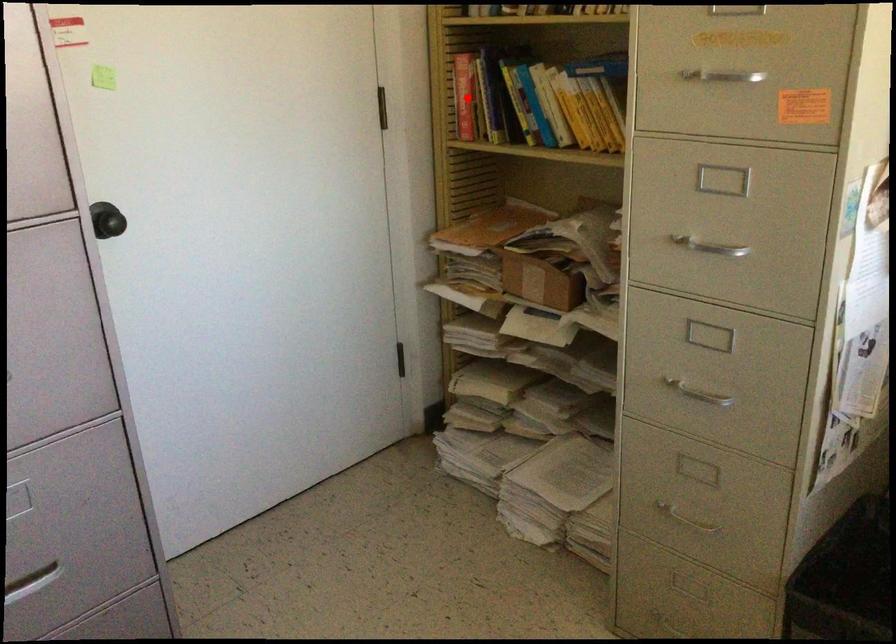
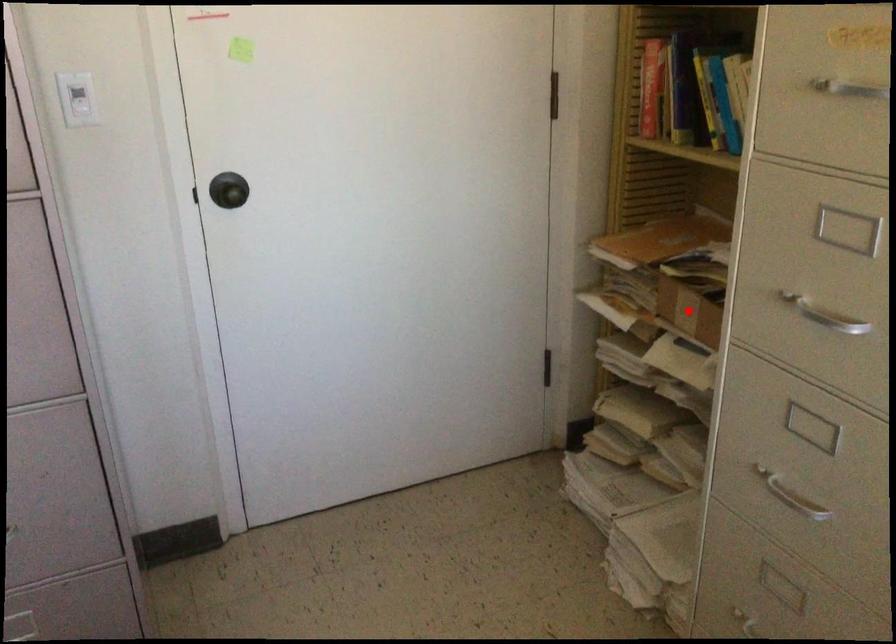
I am providing you with two images of the same scene from different viewpoints. A red point is marked on the first image and another point is marked on the second image. Is the marked point in image1 the same physical position as the marked point in image2?

No